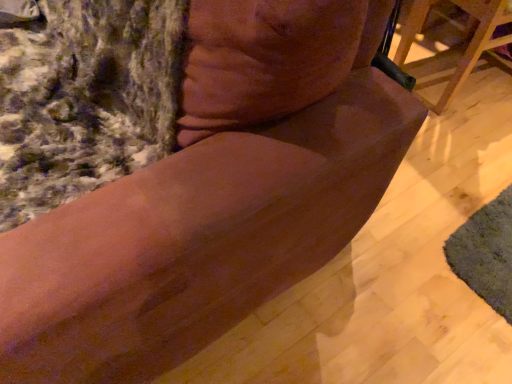
The height and width of the screenshot is (384, 512). What do you see at coordinates (475, 43) in the screenshot?
I see `wooden chair at upper right` at bounding box center [475, 43].

Measure the distance between wooden chair at upper right and camera.

The depth of wooden chair at upper right is 1.33 meters.

Image resolution: width=512 pixels, height=384 pixels. In order to click on wooden chair at upper right in this screenshot , I will do `click(475, 43)`.

The image size is (512, 384). Identify the location of wooden chair at upper right. (475, 43).